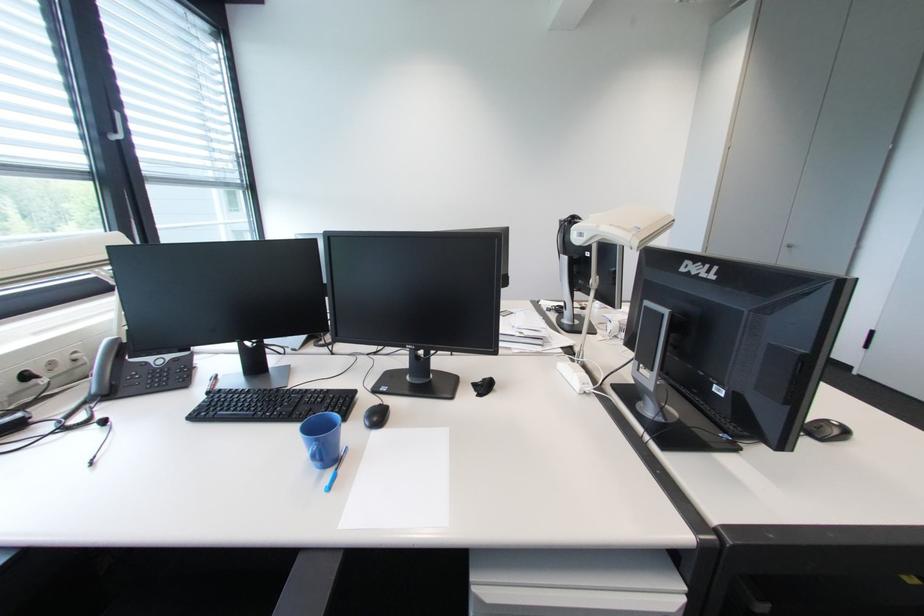
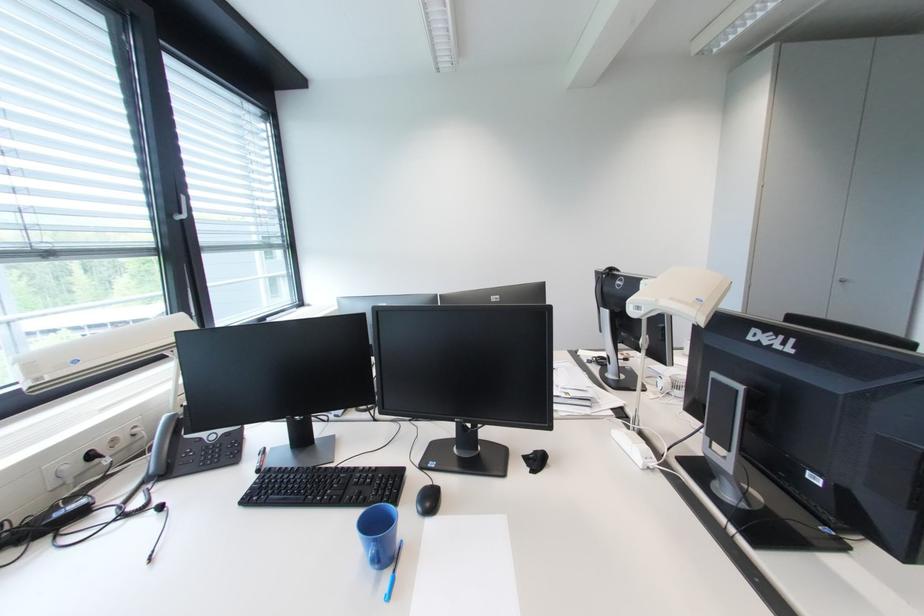
The point at (335, 475) is marked in the first image. Where is the corresponding point in the second image?

(394, 577)